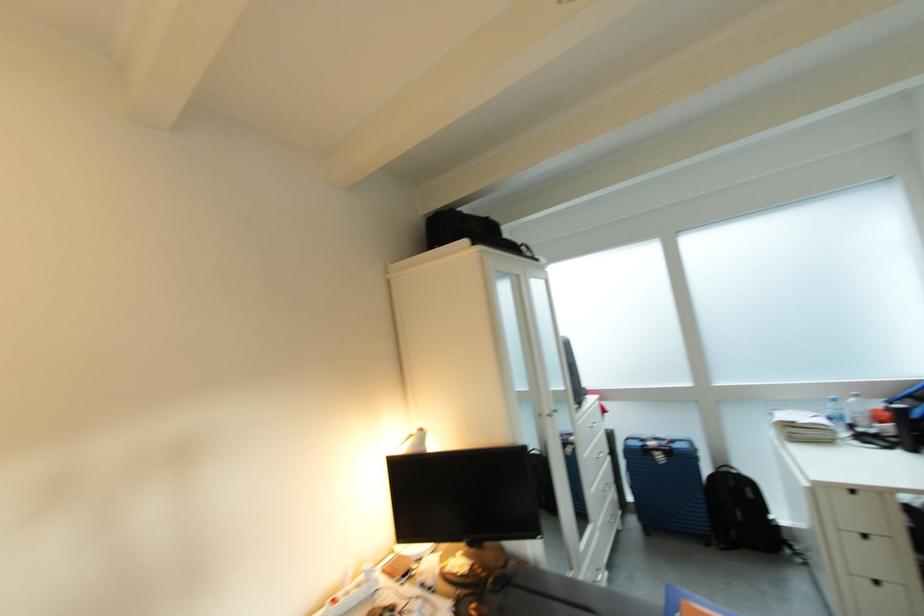
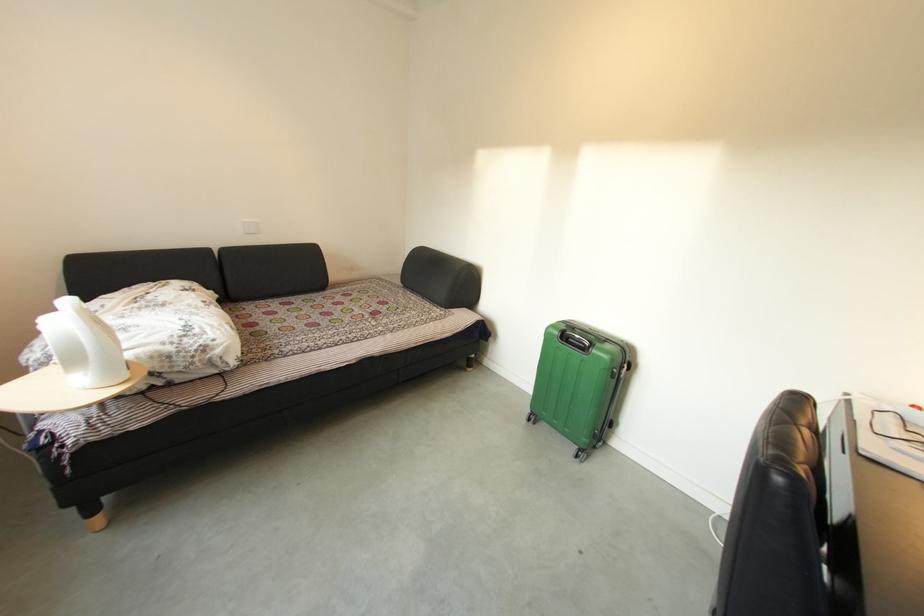
The images are taken continuously from a first-person perspective. In which direction is your viewpoint rotating?

The camera rotated toward left-down.